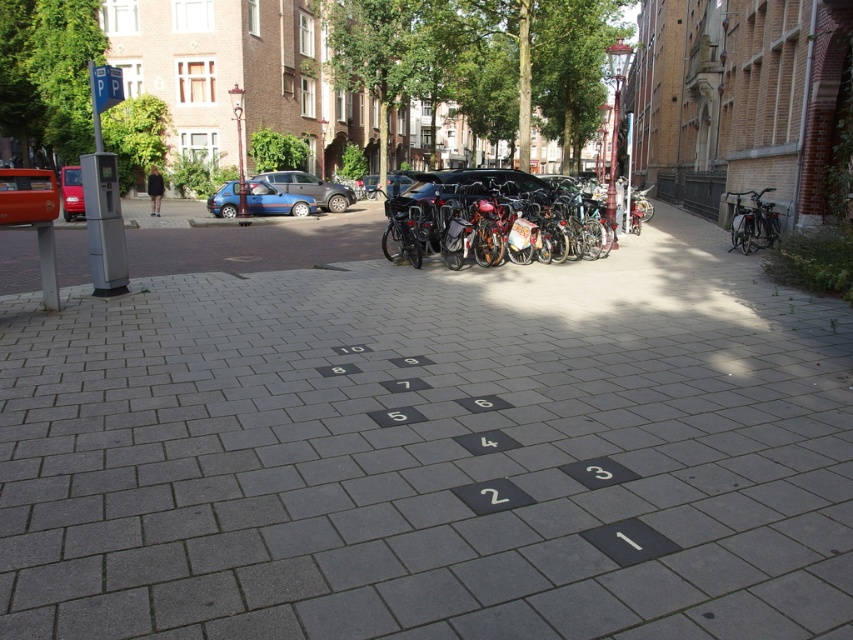
Which is in front, point (608, 237) or point (32, 198)?

Positioned in front is point (32, 198).

Who is taller, shiny metallic bicycles at center or matte red car at left?

shiny metallic bicycles at center is taller.

You are a GUI agent. You are given a task and a screenshot of the screen. Output one action in this format:
    pyautogui.click(x=<x>, y=<y>)
    Task: Click on the shiny metallic bicycles at center
    
    Given the screenshot: What is the action you would take?
    [x=457, y=212]

Consider the image. Does matte blue van at center have a larger size compared to shiny metallic bicycle at right?

Indeed, matte blue van at center has a larger size compared to shiny metallic bicycle at right.

Is point (223, 214) in front of point (734, 195)?

No, it is behind (734, 195).

Does point (231, 205) come closer to viewer compared to point (732, 193)?

No, (231, 205) is behind (732, 193).

The width and height of the screenshot is (853, 640). I want to click on matte blue van at center, so click(x=276, y=200).

Who is higher up, shiny metallic bicycle at right or metallic blue car at center?

metallic blue car at center is higher up.

In the scene shown: Between shiny metallic bicycle at right and metallic blue car at center, which one is positioned lower?

shiny metallic bicycle at right

Is point (764, 228) positioned before point (78, 166)?

That is True.

This screenshot has height=640, width=853. What are the coordinates of `shiny metallic bicycle at right` in the screenshot? It's located at (753, 221).